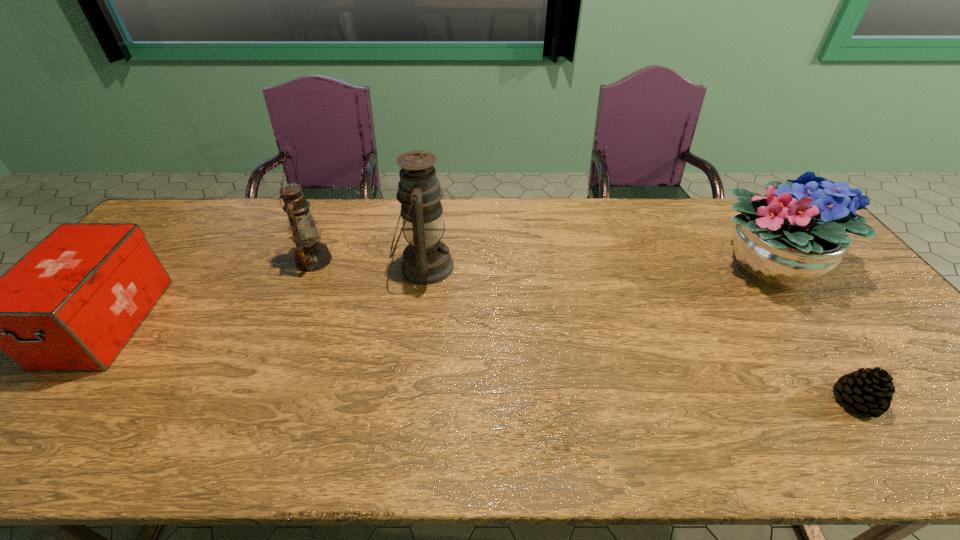
Find the location of a particular element. The image size is (960, 540). vacant region between the right oil lamp and the nearest object is located at coordinates (640, 334).

Locate an element on the screen. empty space that is in between the pinecone and the third object from right to left is located at coordinates (640, 334).

The height and width of the screenshot is (540, 960). In order to click on free space that is in between the left oil lamp and the first-aid kit in this screenshot , I will do (x=210, y=291).

At what (x,y) coordinates should I click in order to perform the action: click on object that stands as the third closest to the nearest object. Please return your answer as a coordinate pair (x, y). Looking at the image, I should click on (311, 255).

Where is `object that is the fourth closest to the nearest object`? object that is the fourth closest to the nearest object is located at coordinates (72, 303).

Where is `free space that satisfies the following two spatial constraints: 1. on the back side of the third tallest object; 2. on the right side of the third object from right to left`? The image size is (960, 540). free space that satisfies the following two spatial constraints: 1. on the back side of the third tallest object; 2. on the right side of the third object from right to left is located at coordinates (424, 267).